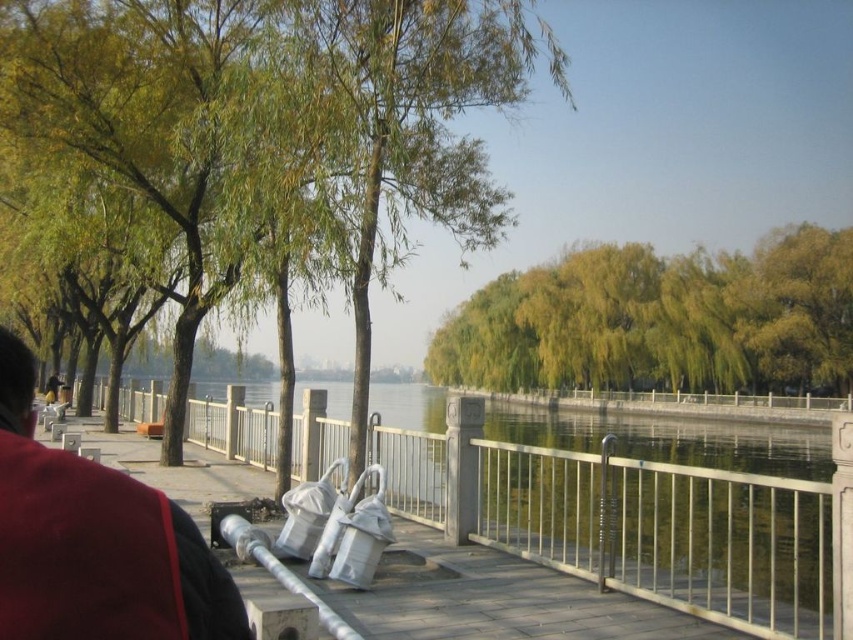
You are standing at the riverside and want to take a photo of a specific point in the scene. The point is located at coordinates point [257,252]. If your camera has a maximum focus range of 10 meters, will it be able to focus on that point?

The distance of point [257,252] from the camera is 9.18 meters, which is within the camera maximum focus range of 10 meters. So yes, the camera can focus on that point.

You are standing at the center of the walkway and want to take a photo of the green leafy tree at left. Which direction should you face to capture it in your camera?

You should face towards the left side of the walkway to capture the green leafy tree at left in your camera since it is located at point [263,144], which is to the left of your current position at the center.